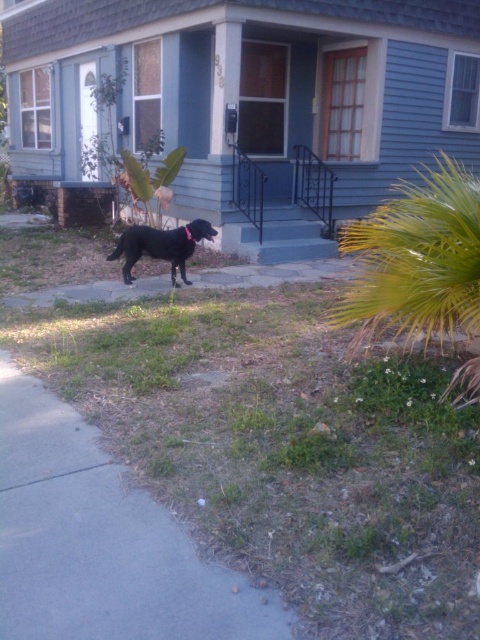
Where is `gray concrete pavement at lower left`? gray concrete pavement at lower left is located at coordinates click(x=100, y=541).

Who is shorter, gray concrete pavement at lower left or black matte dog at center?

Standing shorter between the two is gray concrete pavement at lower left.

You are a GUI agent. You are given a task and a screenshot of the screen. Output one action in this format:
    pyautogui.click(x=<x>, y=<y>)
    Task: Click on the gray concrete pavement at lower left
    The width and height of the screenshot is (480, 640).
    Given the screenshot: What is the action you would take?
    100,541